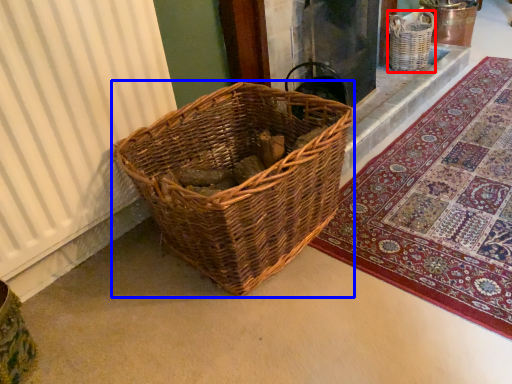
Question: Which object appears closest to the camera in this image, basket (highlighted by a red box) or picnic basket (highlighted by a blue box)?

Choices:
 (A) basket
 (B) picnic basket

Answer: (B)